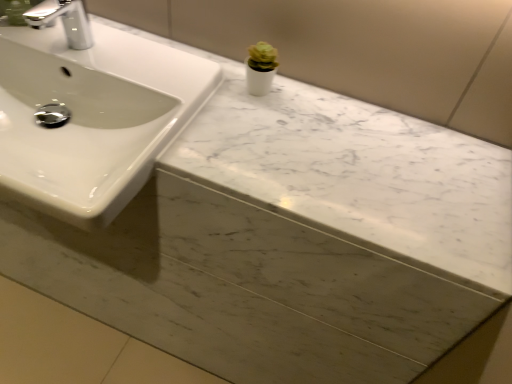
Question: Is white glossy sink at upper left taller or shorter than white marble counter top at upper center?

Choices:
 (A) short
 (B) tall

Answer: (B)

Question: Does point (125, 178) appear closer or farther from the camera than point (227, 77)?

Choices:
 (A) closer
 (B) farther

Answer: (A)

Question: Based on their relative distances, which object is nearer to the white glossy sink at upper left?

Choices:
 (A) silver metallic faucet at upper left
 (B) white marble counter top at upper center

Answer: (A)

Question: Which object is positioned farthest from the silver metallic faucet at upper left?

Choices:
 (A) white marble counter top at upper center
 (B) white glossy sink at upper left

Answer: (A)